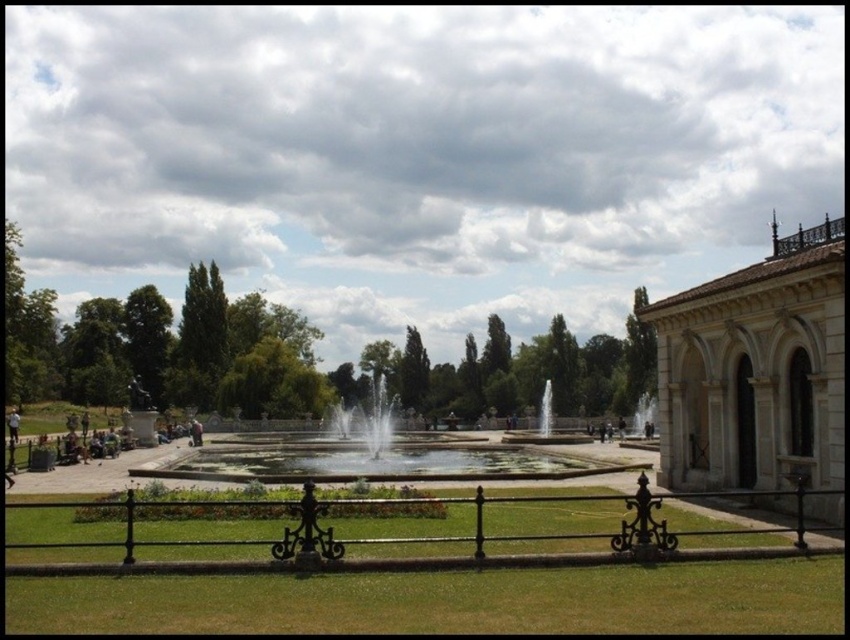
You are a visitor in the park and want to take a photo of both the white stone building at right and the clear water fountain at center. Which object should you focus on first to ensure both are in the frame?

You should focus on the white stone building at right first because it is closer to the viewer than the clear water fountain at center, so adjusting the camera to include it ensures the fountain will also be in the frame.

You are a photographer planning to take a photo of the white stone building at right and the clear water fountain at center. Which object should you focus on first if you want to capture both in a single frame without moving the camera?

The white stone building at right is larger in size than the clear water fountain at center, so you should focus on the white stone building at right first to ensure it is sharp and in focus before capturing the smaller fountain.